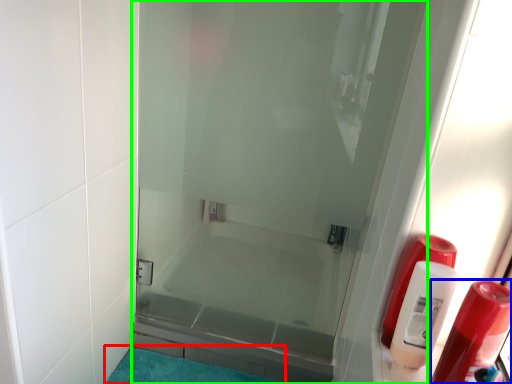
Question: Which object is the farthest from bath mat (highlighted by a red box)? Choose among these: soap dispenser (highlighted by a blue box) or door (highlighted by a green box).

Choices:
 (A) soap dispenser
 (B) door

Answer: (A)